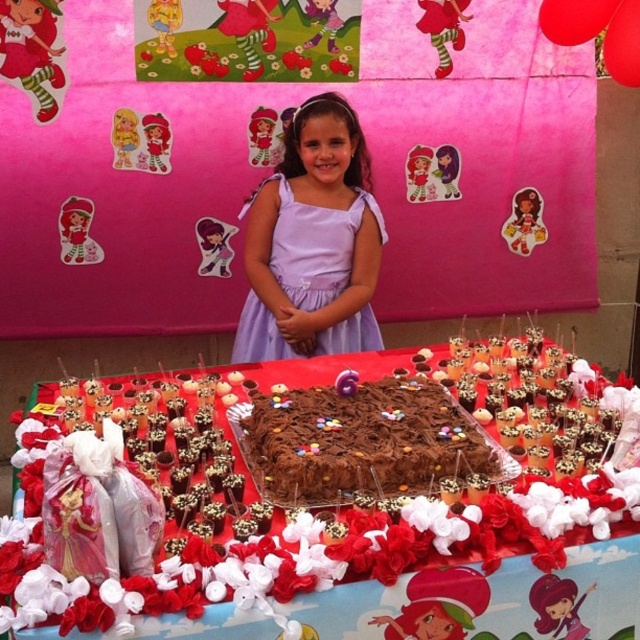
Question: Observing the image, what is the correct spatial positioning of chocolate cake at center in reference to chocolatesmoothcake at center?

Choices:
 (A) above
 (B) below

Answer: (B)

Question: Which point appears closest to the camera in this image?

Choices:
 (A) (346, 241)
 (B) (300, 422)
 (C) (154, 394)

Answer: (B)

Question: Considering the real-world distances, which object is closest to the chocolate cake at center?

Choices:
 (A) lavender satin dress at center
 (B) chocolatesmoothcake at center

Answer: (B)

Question: Which point is farther to the camera?

Choices:
 (A) chocolatesmoothcake at center
 (B) lavender satin dress at center

Answer: (B)

Question: Is chocolate cake at center to the right of chocolatesmoothcake at center from the viewer's perspective?

Choices:
 (A) yes
 (B) no

Answer: (B)

Question: Does chocolatesmoothcake at center appear on the right side of lavender satin dress at center?

Choices:
 (A) no
 (B) yes

Answer: (B)